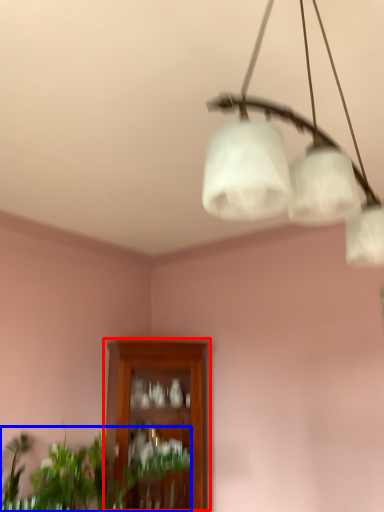
Question: Which object appears farthest to the camera in this image, cabinetry (highlighted by a red box) or houseplant (highlighted by a blue box)?

Choices:
 (A) cabinetry
 (B) houseplant

Answer: (A)